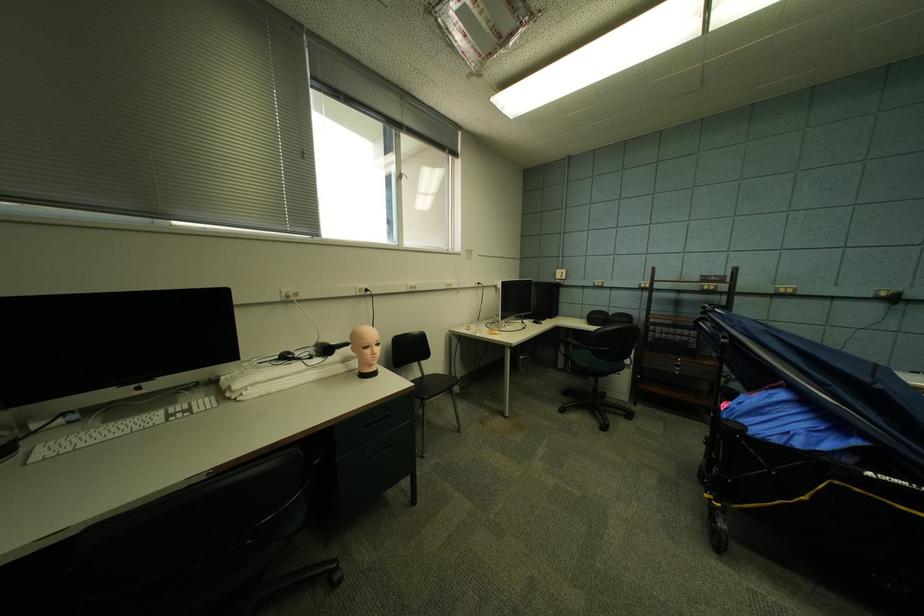
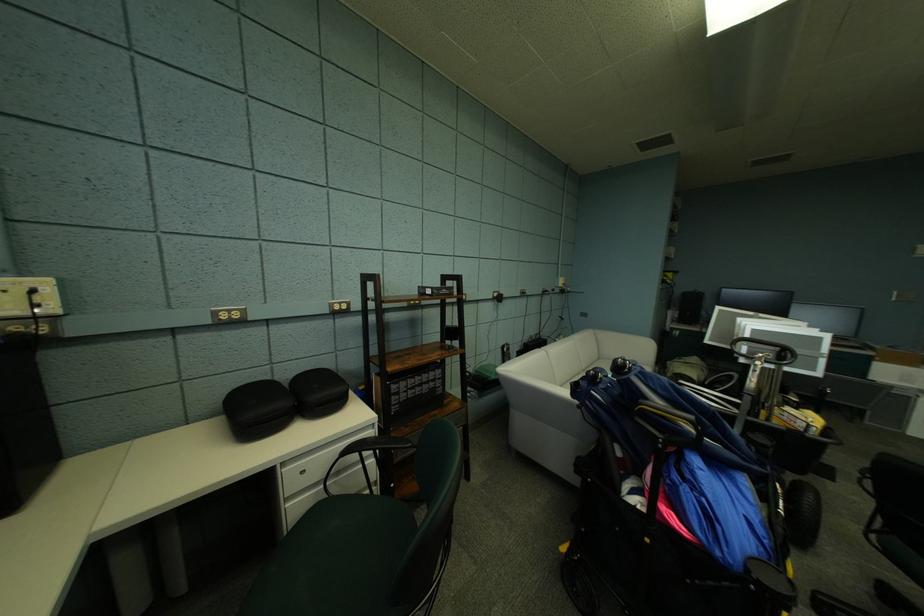
In the second image, find the point that corresponds to [618,317] in the first image.

(297, 389)